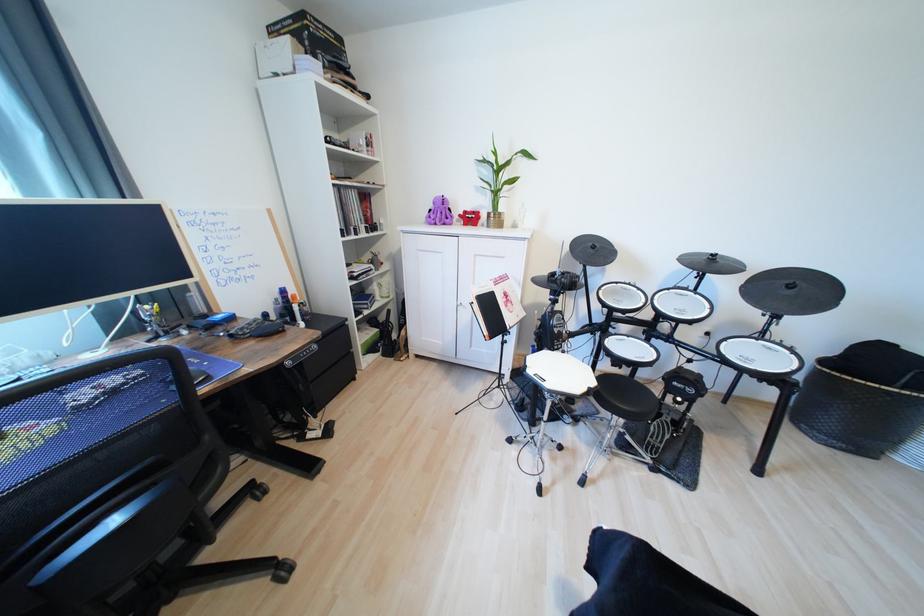
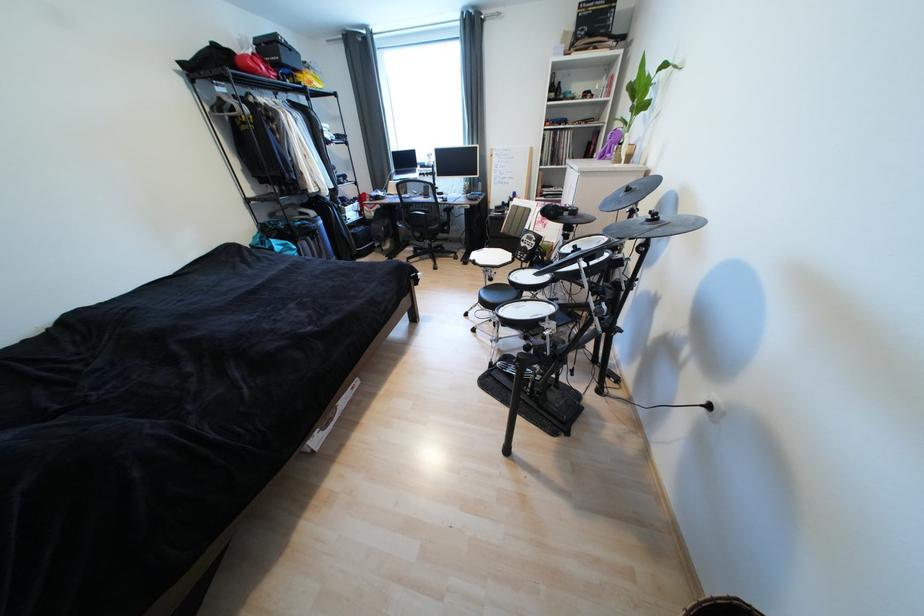
Find the pixel in the second image that matches pixel 599 252 in the first image.

(628, 196)